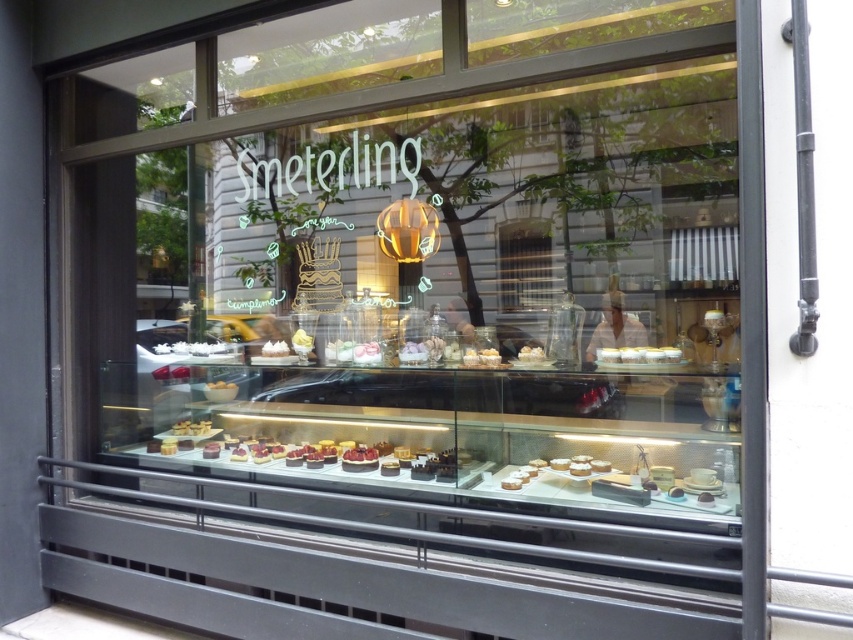
You are a customer at the bakery and want to buy the tallest cake available. Which cake should you choose between the white cream cake at center and the white glossy cake at center?

The white cream cake at center is much taller than the white glossy cake at center, so you should choose the white cream cake at center.

You are a customer looking at the bakery window. You see two cakes at the center of the display. Which cake has a greater width, the white cream cake at center or the white glossy cake at center?

The white cream cake at center has a greater width than the white glossy cake at center according to the description.